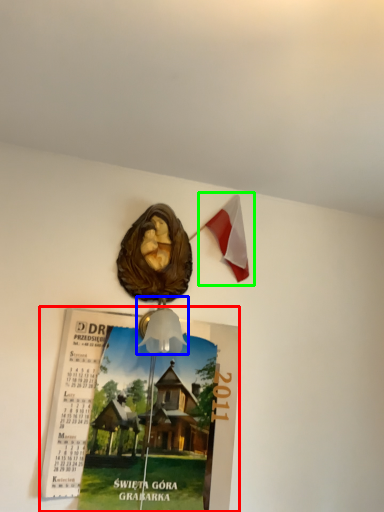
Question: Which object is positioned closest to poster page (highlighted by a red box)? Select from lamp (highlighted by a blue box) and flag (highlighted by a green box).

Choices:
 (A) lamp
 (B) flag

Answer: (A)